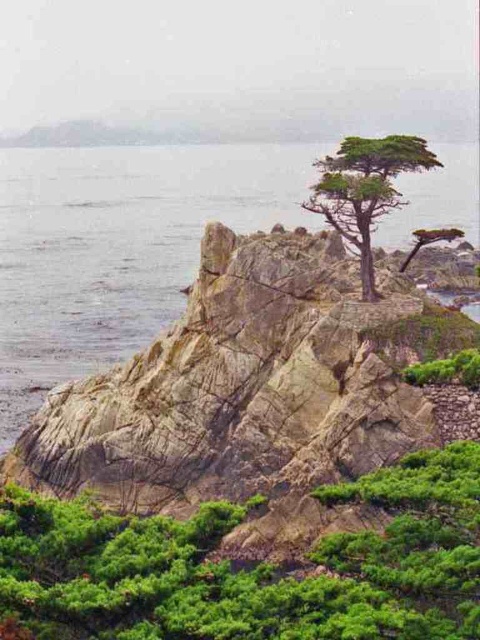
You are a hiker who wants to cross from the rocky area to the green vegetation in the foreground. The path leads you to the clear water at center and the green textured tree at center. Which object is closer to you as you start your journey?

The clear water at center is 129.58 meters away from the green textured tree at center. Since you are starting from the rocky area, the clear water at center is closer to you than the green textured tree at center, so you will reach the clear water at center first.

You are a hiker who wants to cross the clear water at center to reach the green textured tree at center. Can you safely walk across the water?

The clear water at center is taller than green textured tree at center, which means the water is deeper than the tree height. Therefore, you cannot safely walk across the clear water at center as it is too deep.